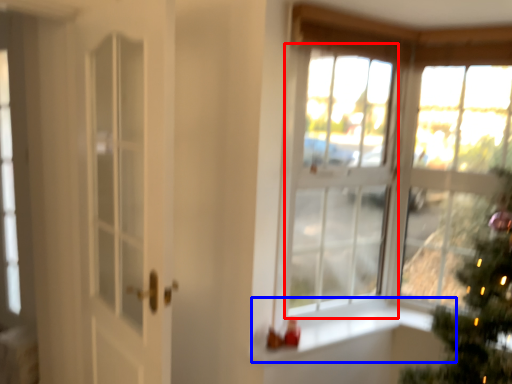
Question: Which point is further to the camera, window (highlighted by a red box) or window sill (highlighted by a blue box)?

Choices:
 (A) window
 (B) window sill

Answer: (A)